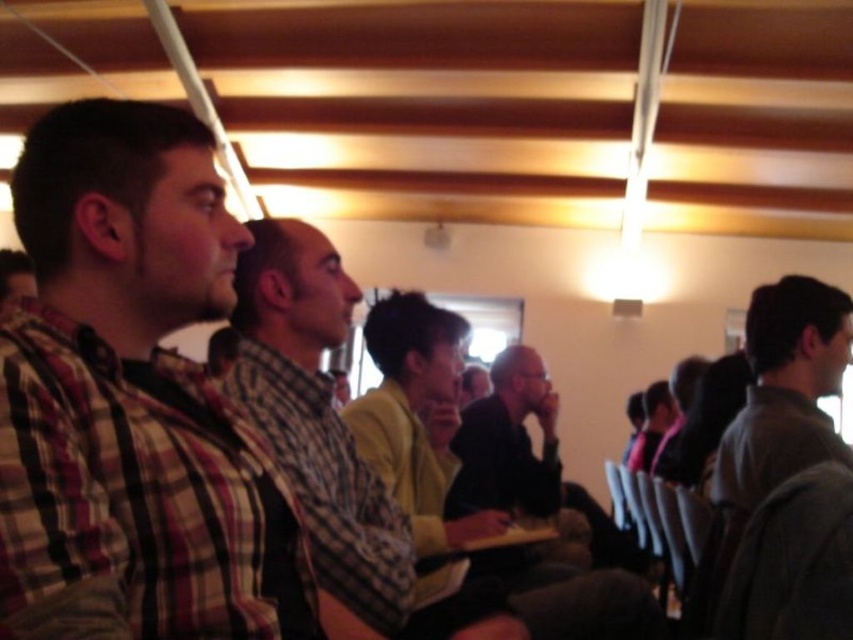
You are organizing a photo shoot and need to arrange two models wearing the plaid shirt at left and dark gray sweater at right. Based on their current positions and sizes in the image, which model should you place closer to the camera to ensure they appear the same size in the final photo?

The plaid shirt at left currently occupies less space than the dark gray sweater at right. To make them appear the same size in the photo, the plaid shirt at left should be placed closer to the camera since it is smaller and needs to be magnified, while the dark gray sweater at right can be positioned farther back.

You are standing in the conference room and want to hand a document to the person wearing the plaid shirt at left. If your arm can reach 24 inches, can you reach them without moving?

The plaid shirt at left and viewer are 23.96 inches apart from each other, so yes, your arm can reach them since 23.96 inches is within the 24 inch reach.

You are organizing a group photo and need to arrange two people based on their clothing sizes. You have a plaid shirt at center and a dark gray sweater at right. Which person should stand on the left to maintain a size gradient from smallest to largest?

The plaid shirt at center should stand on the left because its width is less than the dark gray sweater at right, creating a size gradient from smallest to largest.